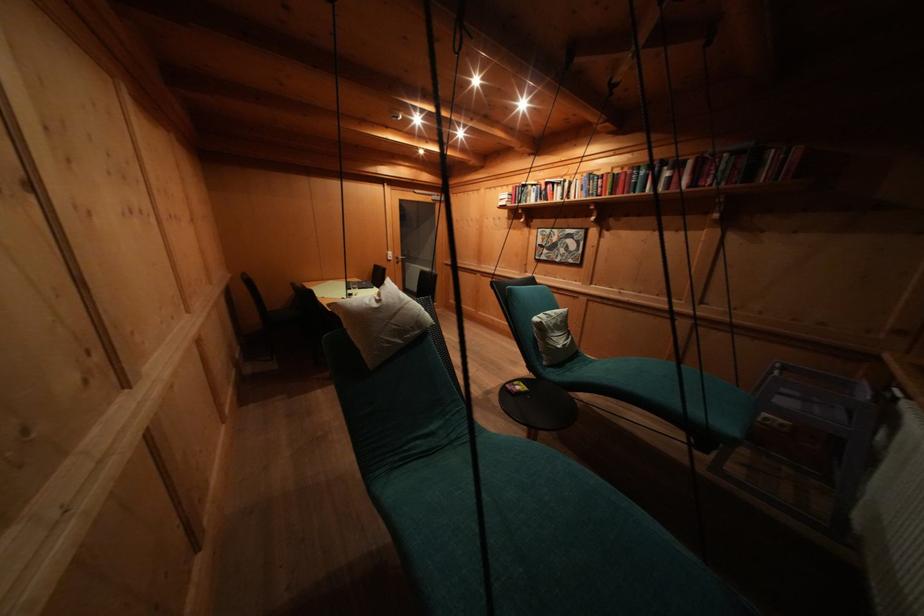
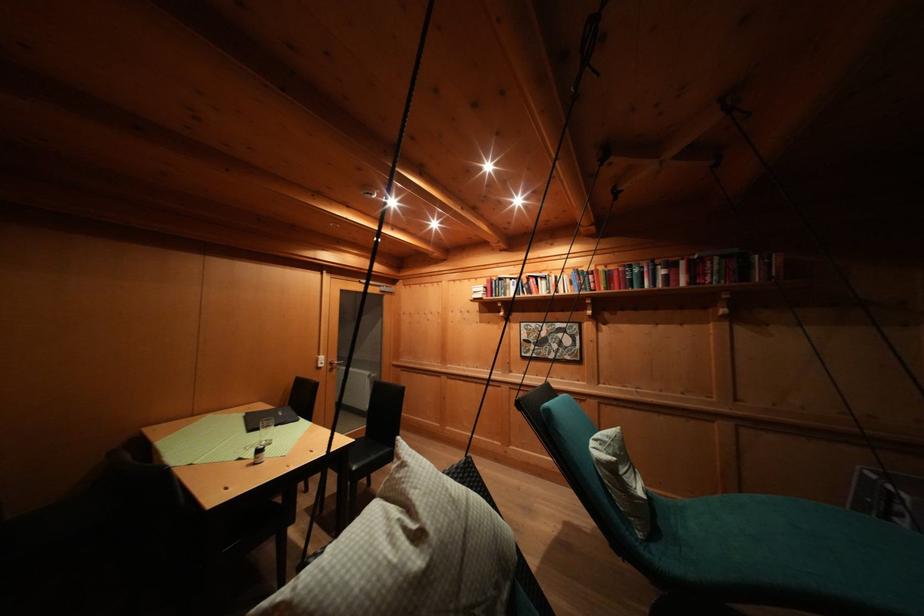
Where in the second image is the point corresponding to point (396, 257) from the first image?

(327, 362)